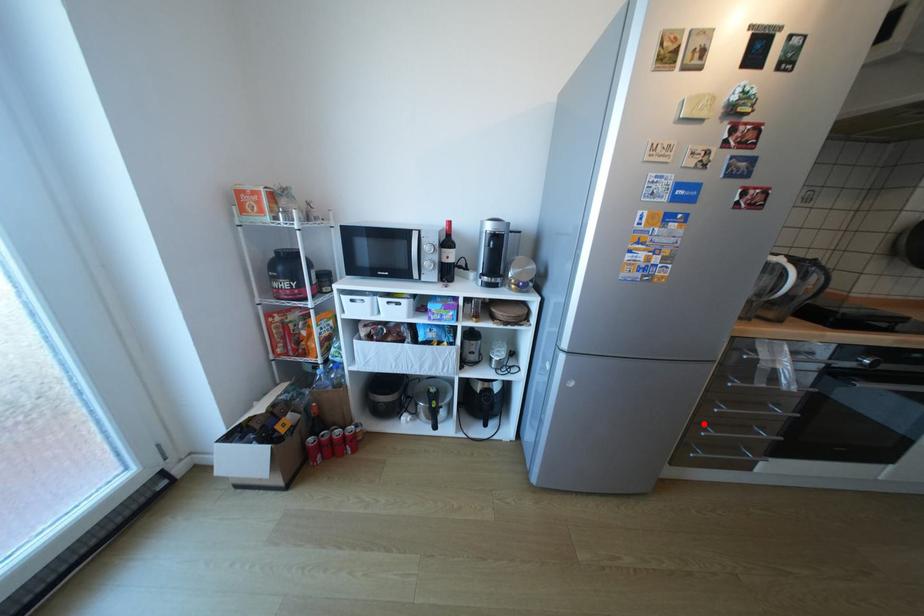
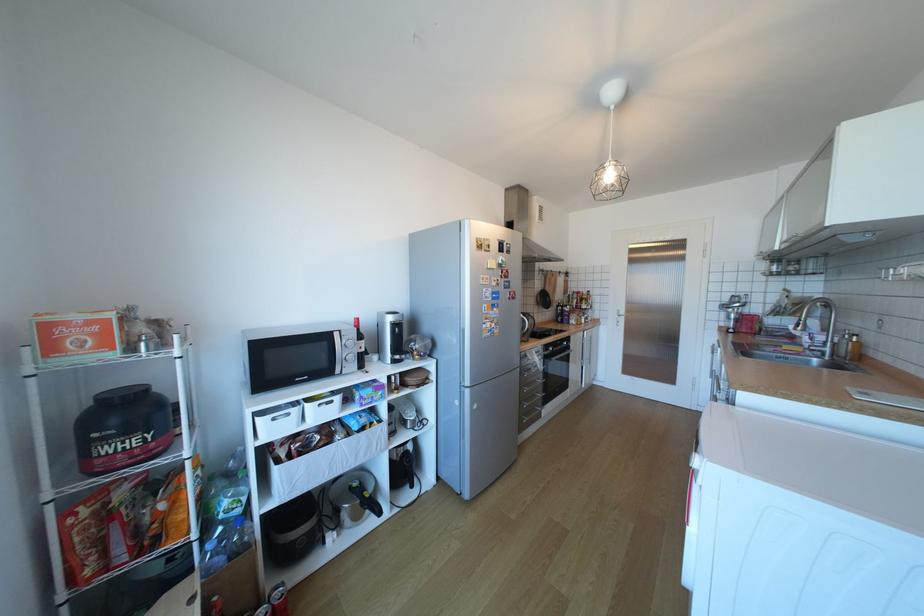
The point at the highlighted location is marked in the first image. Where is the corresponding point in the second image?

(529, 403)